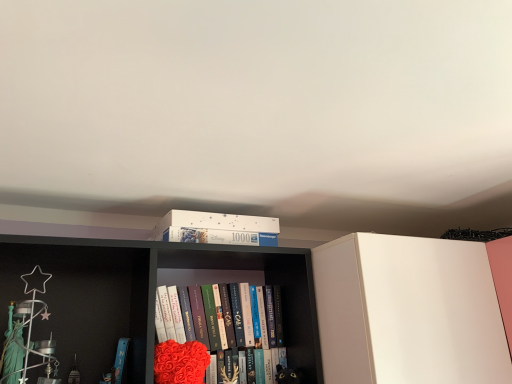
Question: Is velvety red heart at center in front of or behind white matte puzzle box at upper center in the image?

Choices:
 (A) behind
 (B) front

Answer: (A)

Question: Is velvety red heart at center taller or shorter than white matte puzzle box at upper center?

Choices:
 (A) tall
 (B) short

Answer: (B)

Question: Based on their relative distances, which object is farther from the velvety red heart at center?

Choices:
 (A) white cardboard puzzle box at upper center
 (B) hardcover book at center
 (C) white matte puzzle box at upper center

Answer: (C)

Question: Considering the real-world distances, which object is closest to the velvety red heart at center?

Choices:
 (A) white cardboard puzzle box at upper center
 (B) hardcover book at center
 (C) white matte puzzle box at upper center

Answer: (B)